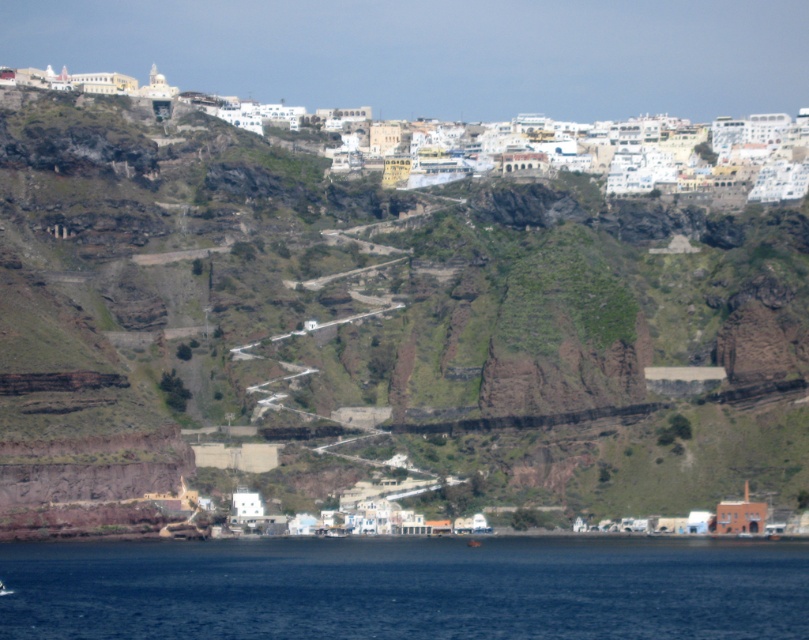
Is brown rock at center bigger than white stone buildings at upper center?

No.

Between brown rock at center and white stone buildings at upper center, which one appears on the left side from the viewer's perspective?

white stone buildings at upper center is more to the left.

Where is `brown rock at center`? brown rock at center is located at coordinates (379, 324).

In the scene shown: Can you confirm if dark blue water at lower center is shorter than white stone buildings at upper center?

Yes, dark blue water at lower center is shorter than white stone buildings at upper center.

Who is shorter, dark blue water at lower center or white stone buildings at upper center?

dark blue water at lower center is shorter.

Is point (66, 634) positioned after point (807, 131)?

No, (66, 634) is in front of (807, 131).

What are the coordinates of `dark blue water at lower center` in the screenshot? It's located at (405, 588).

Which is in front, point (13, 384) or point (146, 620)?

Point (146, 620) is more forward.

Looking at this image, who is positioned more to the left, brown rock at center or dark blue water at lower center?

brown rock at center

At what (x,y) coordinates should I click in order to perform the action: click on brown rock at center. Please return your answer as a coordinate pair (x, y). The height and width of the screenshot is (640, 809). Looking at the image, I should click on (379, 324).